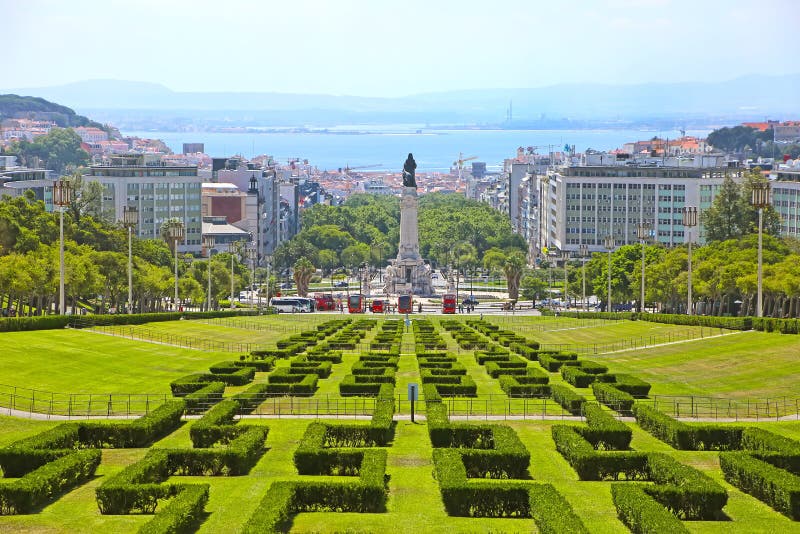
The width and height of the screenshot is (800, 534). Identify the location of statue. (409, 225).